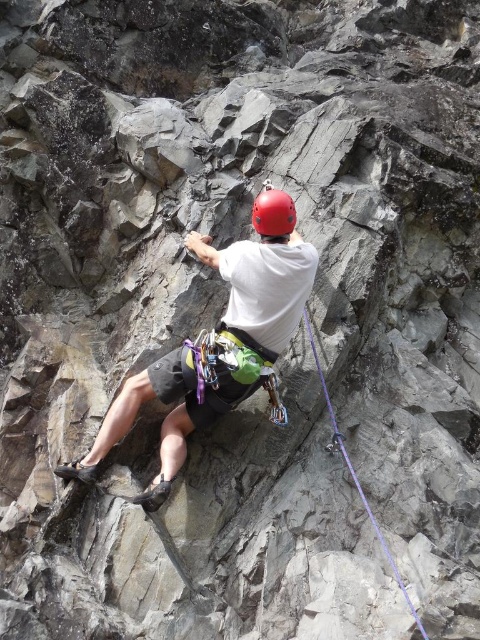
You are a safety inspector checking the climbing gear of the climber in the image. The purple synthetic rope at center and the matte red helmet at center are both critical for safety. Which of these two items has a greater width?

The purple synthetic rope at center has a greater width than the matte red helmet at center, as stated in the description.

You are a safety inspector assessing the rock climber. You need to determine if the matte white helmet at center could potentially block the climber from seeing the purple synthetic rope at center. Based on their width, is this a possible concern?

The matte white helmet at center might be wider than purple synthetic rope at center, so there is a possibility that the helmet could obstruct the climber from seeing the rope.

You are a safety inspector checking the setup of the rock climber. Based on the image, is the purple synthetic rope at center positioned correctly relative to the matte red helmet at center for a standard belay system?

The purple synthetic rope at center is below the matte red helmet at center, which is correct for a standard belay system since the rope should be positioned lower than the climber to ensure proper belay tension and safety.